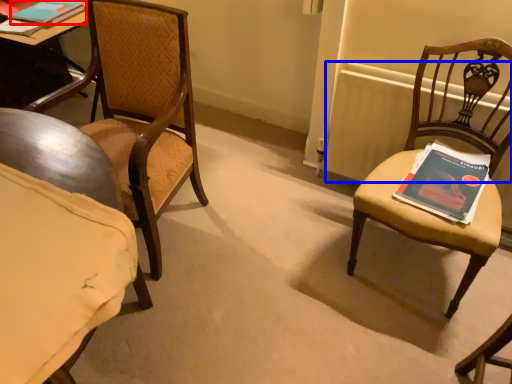
Question: Which object is further to the camera taking this photo, book (highlighted by a red box) or radiator (highlighted by a blue box)?

Choices:
 (A) book
 (B) radiator

Answer: (A)